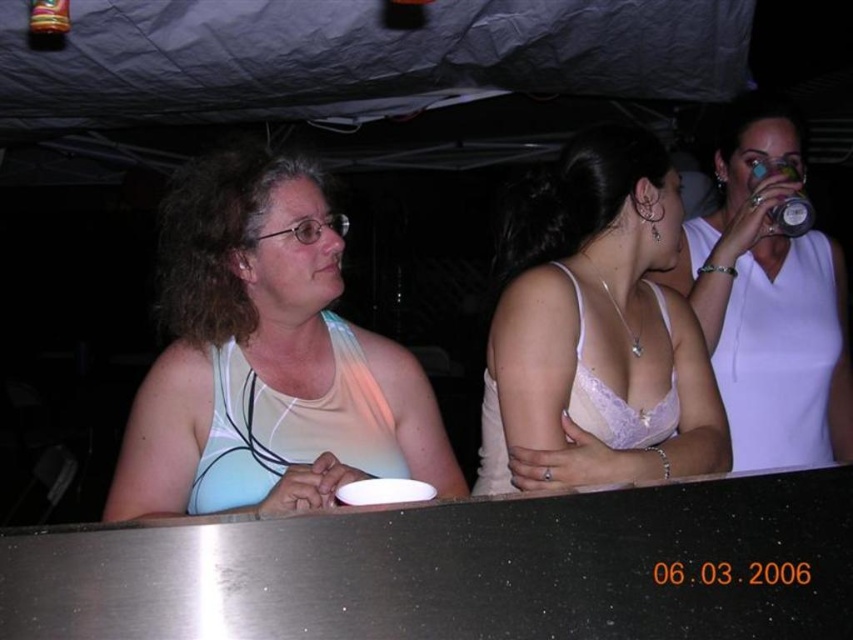
You are standing at a distance of 1.5 meters from the point marked at coordinates (668, 400) in the image. Can you reach the point without moving closer?

The point at coordinates (668, 400) is 1.34 meters away from the viewer. Since you are currently 1.5 meters away, you are slightly farther than the point. To reach it, you would need to move 0.16 meters closer.

You are a photographer at a beach party. You want to take a photo of the white matte tank top at left and the white matte bikini top at left. The camera you are using has a minimum focus distance of 1.5 inches. Can you focus on both items at the same time?

The distance between the white matte tank top at left and the white matte bikini top at left is 1.73 inches, which is greater than the camera minimum focus distance of 1.5 inches. Therefore, the camera can focus on both items simultaneously.

You are standing at the center of the image and want to pick up an object. Which point, point (380,385) or point (335,369), is closer to you?

Point (380,385) is further to the camera than point (335,369), so the point closer to you is point (335,369).